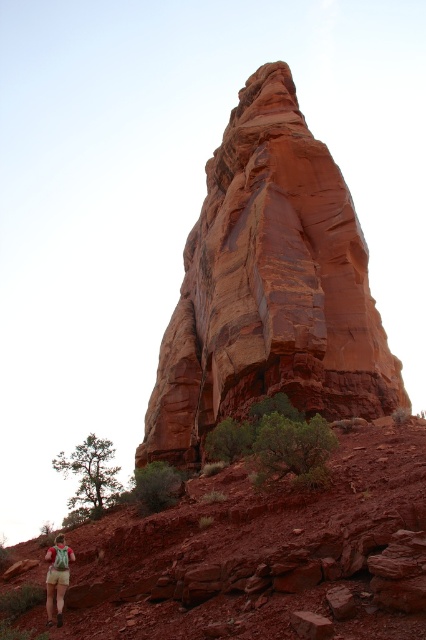
You are a hiker who wants to take a photo of the rustic sandstone rock formation at center and the khaki shorts at lower left. Which object should you focus on first if you want to capture both in one shot without moving the camera?

The rustic sandstone rock formation at center is located above the khaki shorts at lower left, so you should focus on the khaki shorts at lower left first to ensure both are in focus since it is closer to the camera.